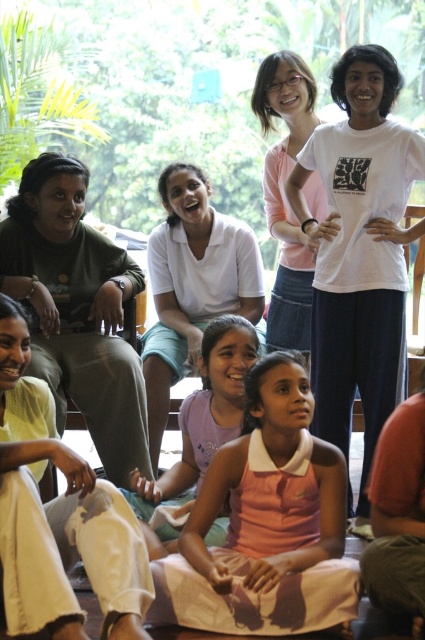
Question: Which is farther from the pink matte shirt at upper center?

Choices:
 (A) pink fabric dress at center
 (B) pink cotton dress at center
 (C) white cotton shirt at center
 (D) matte green shirt at left

Answer: (B)

Question: Is pink cotton dress at center to the right of white cotton shirt at center from the viewer's perspective?

Choices:
 (A) yes
 (B) no

Answer: (A)

Question: Estimate the real-world distances between objects in this image. Which object is closer to the pink matte shirt at upper center?

Choices:
 (A) pink cotton dress at center
 (B) white cotton shirt at center
 (C) pink fabric dress at center
 (D) matte green shirt at left

Answer: (B)

Question: Which point is farther from the camera taking this photo?

Choices:
 (A) (25, 444)
 (B) (272, 360)
 (C) (204, 221)

Answer: (C)

Question: Is the position of light yellow cotton shirt at lower left more distant than that of pink matte shirt at upper center?

Choices:
 (A) yes
 (B) no

Answer: (B)

Question: Can you confirm if pink cotton dress at center is thinner than pink matte shirt at upper center?

Choices:
 (A) yes
 (B) no

Answer: (B)